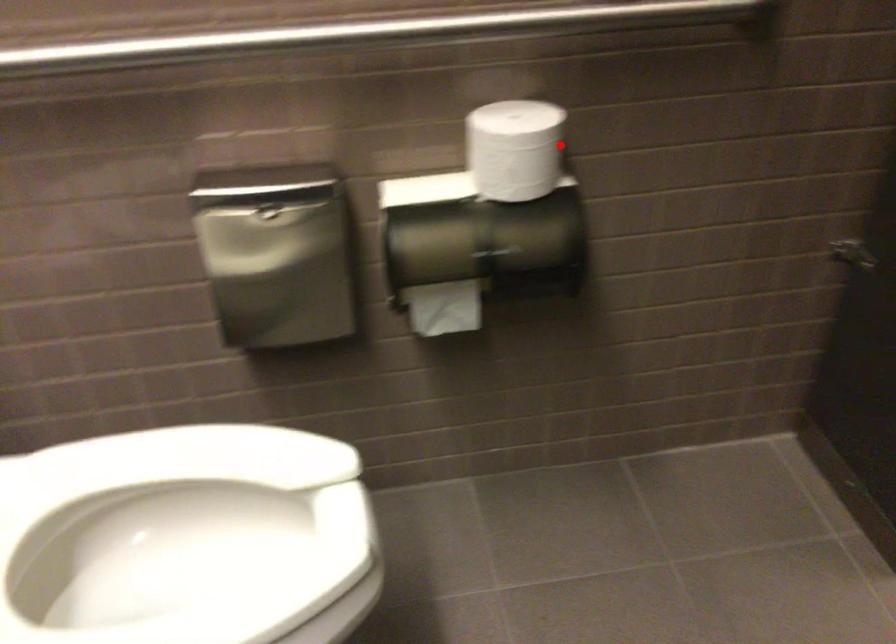
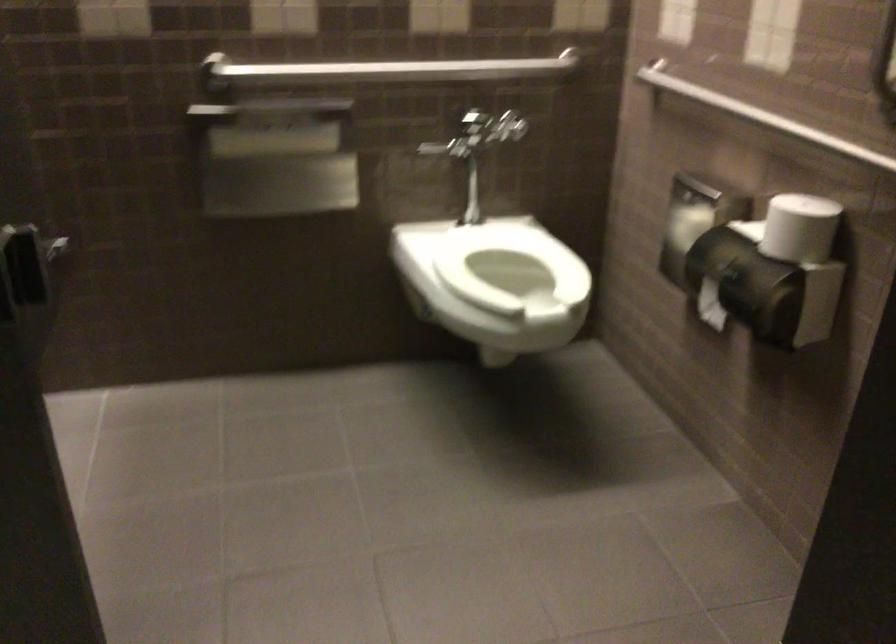
Question: A red point is marked in image1. In image2, is the corresponding 3D point closer to the camera or farther? Reply with the corresponding letter.

Choices:
 (A) The corresponding 3D point is closer.
 (B) The corresponding 3D point is farther.

Answer: (B)